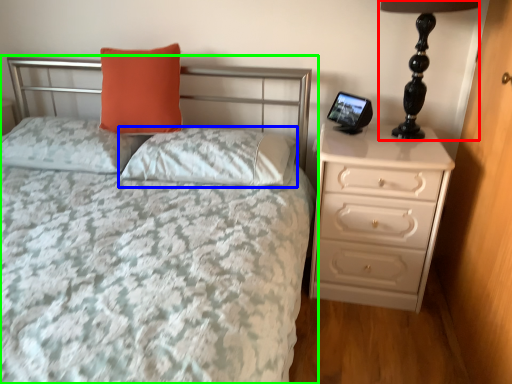
Question: Based on their relative distances, which object is farther from table lamp (highlighted by a red box)? Choose from pillow (highlighted by a blue box) and bed (highlighted by a green box).

Choices:
 (A) pillow
 (B) bed

Answer: (A)